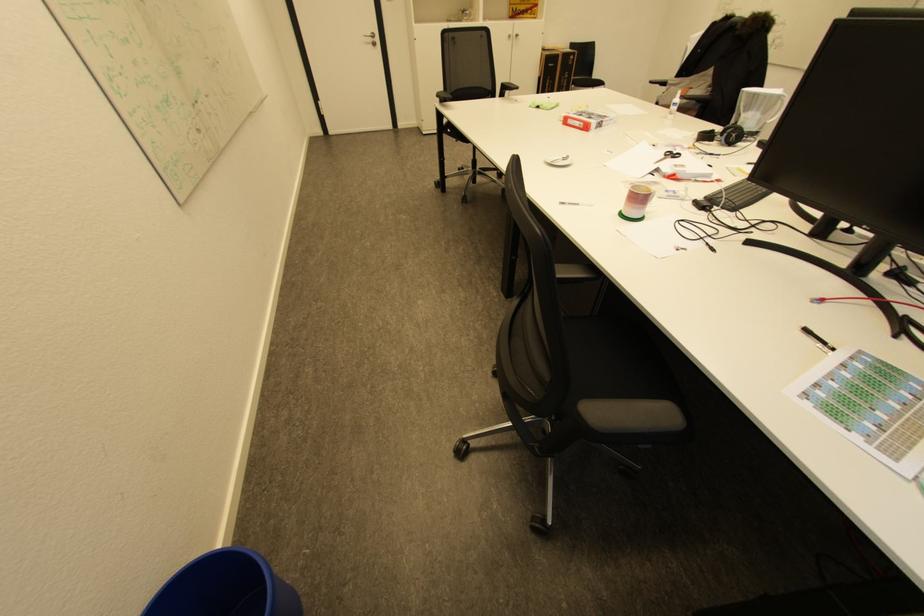
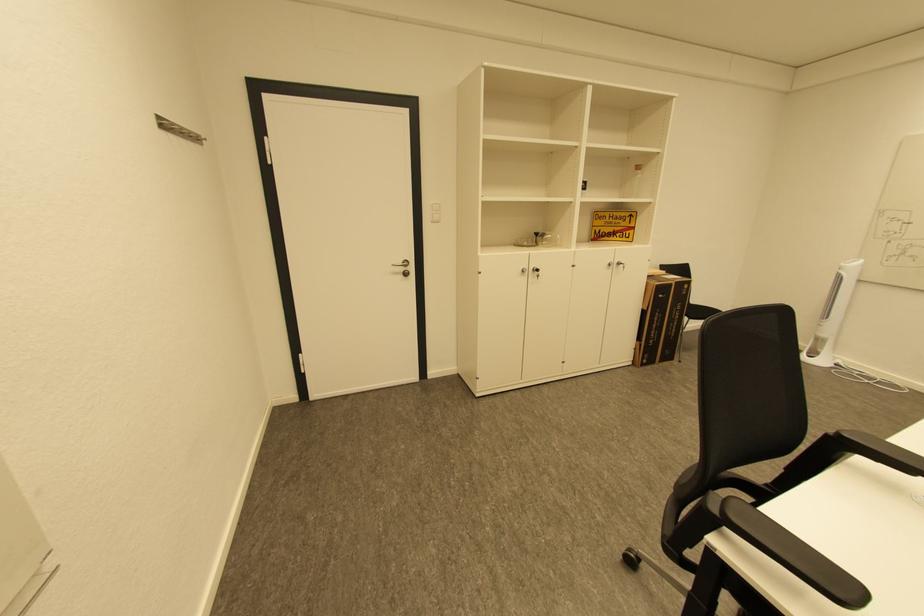
Locate, in the second image, the point that corresponds to the point at 378,41 in the first image.

(408, 270)